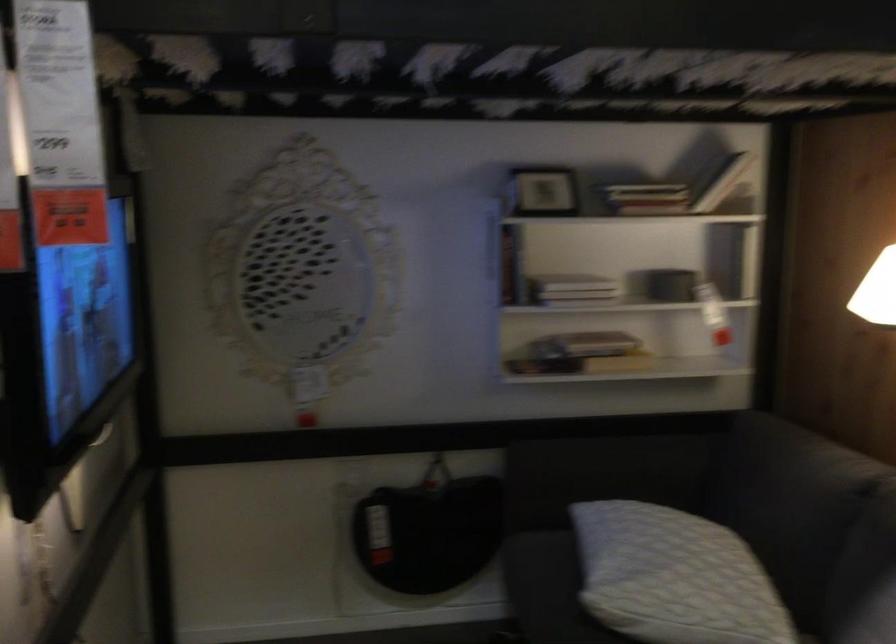
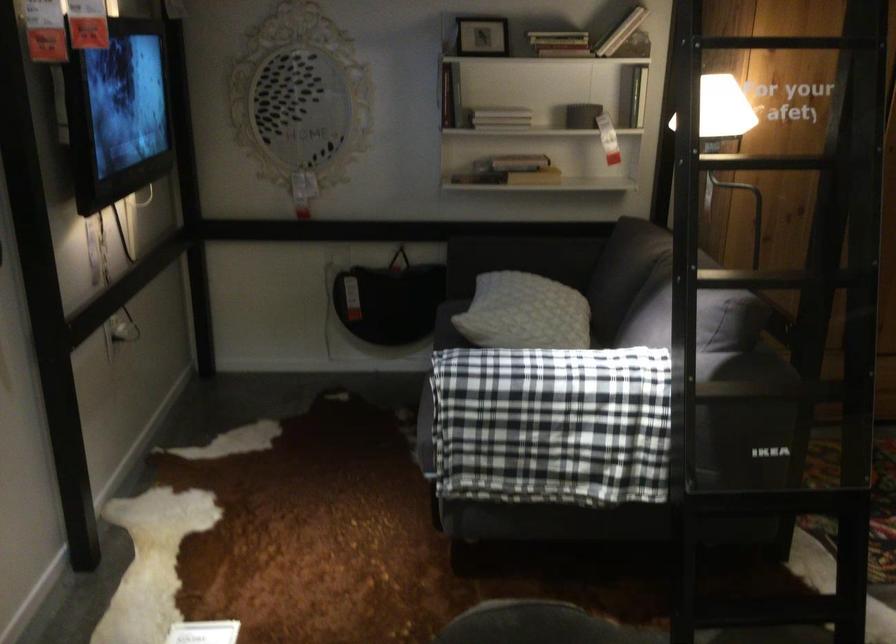
The point at (590,366) is marked in the first image. Where is the corresponding point in the second image?

(509, 171)